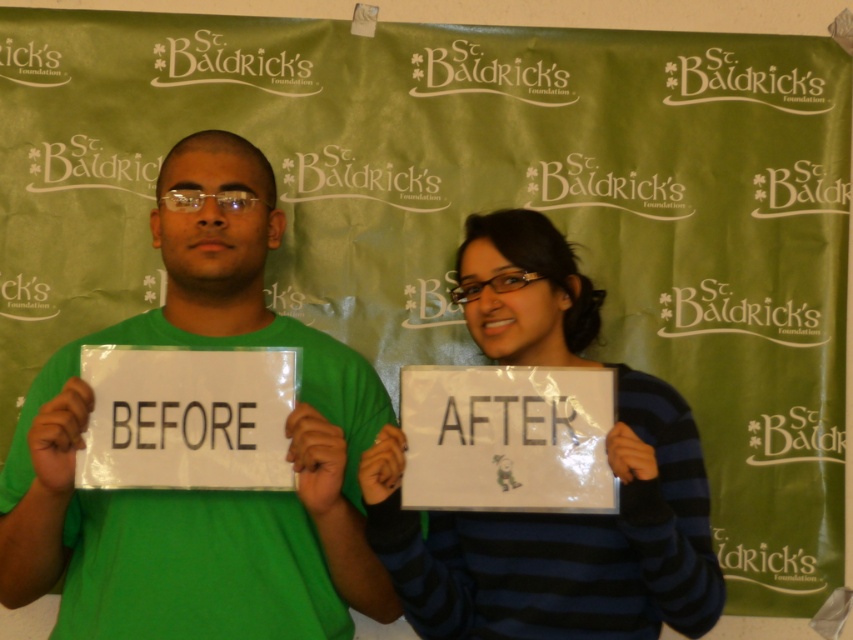
Is green matte shirt at center bigger than striped sweater at center?

Yes, green matte shirt at center is bigger than striped sweater at center.

Between point (38, 412) and point (503, 218), which one is positioned in front?

Point (38, 412) is in front.

Locate an element on the screen. green matte shirt at center is located at coordinates (202, 490).